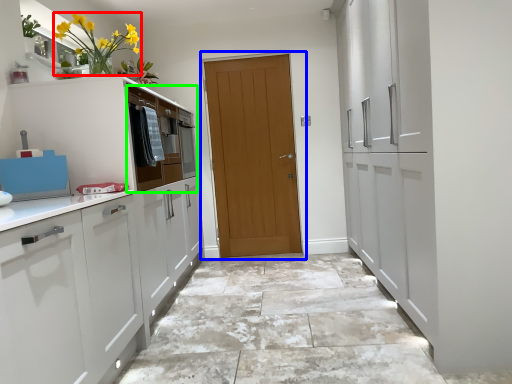
Question: Considering the real-world distances, which object is closest to floral arrangement (highlighted by a red box)? door (highlighted by a blue box) or drawer (highlighted by a green box).

Choices:
 (A) door
 (B) drawer

Answer: (B)